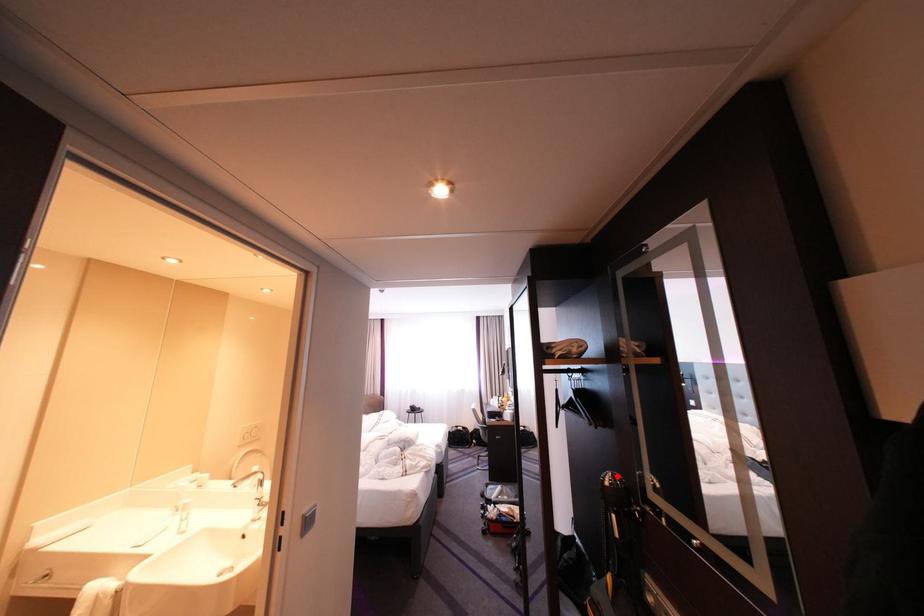
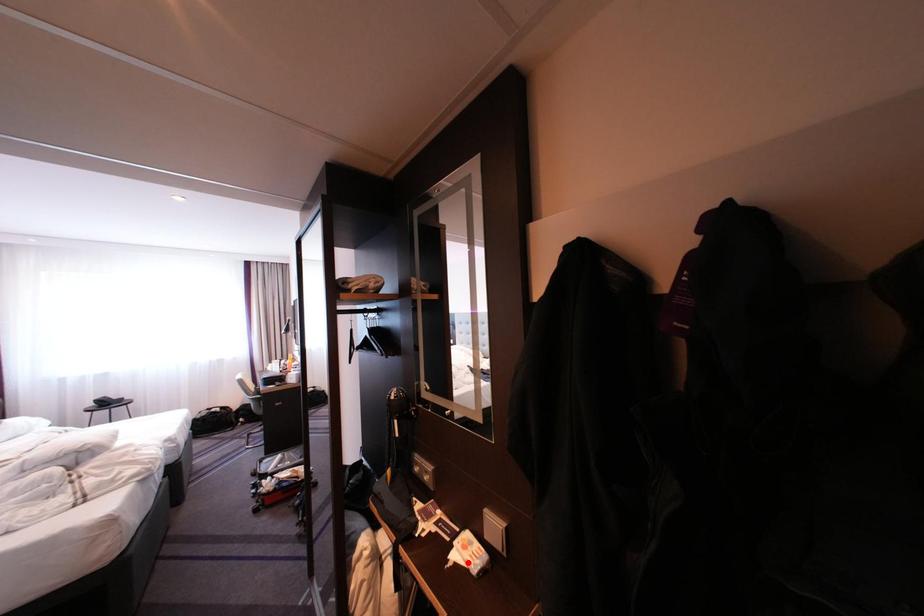
I am providing you with two images of the same scene from different viewpoints. A red point is marked on the first image and another point is marked on the second image. Do the highlighted points in image1 and image2 indicate the same real-world spot?

No